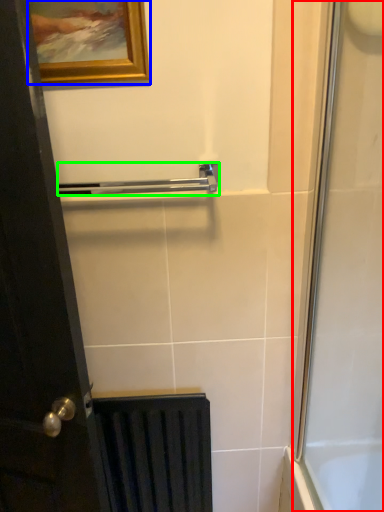
Question: Which object is the closest to the screen door (highlighted by a red box)? Choose among these: picture frame (highlighted by a blue box) or towel bar (highlighted by a green box).

Choices:
 (A) picture frame
 (B) towel bar

Answer: (B)